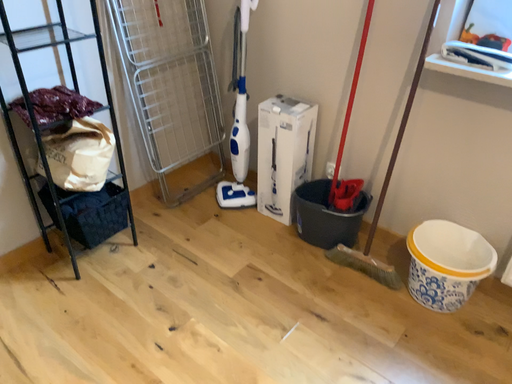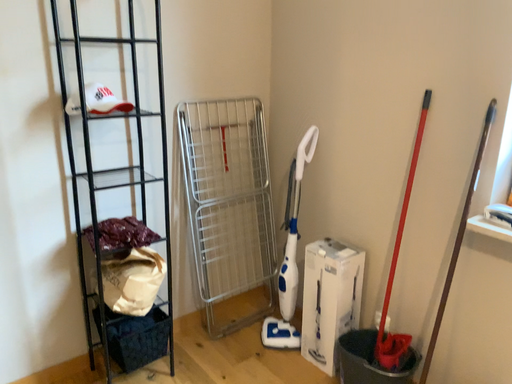
Question: How did the camera likely rotate when shooting the video?

Choices:
 (A) rotated upward
 (B) rotated downward

Answer: (A)